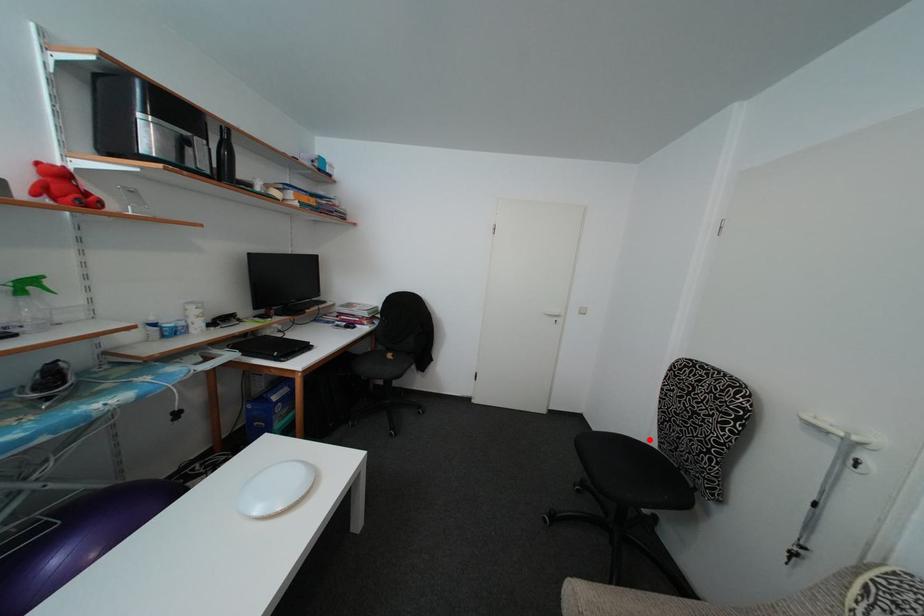
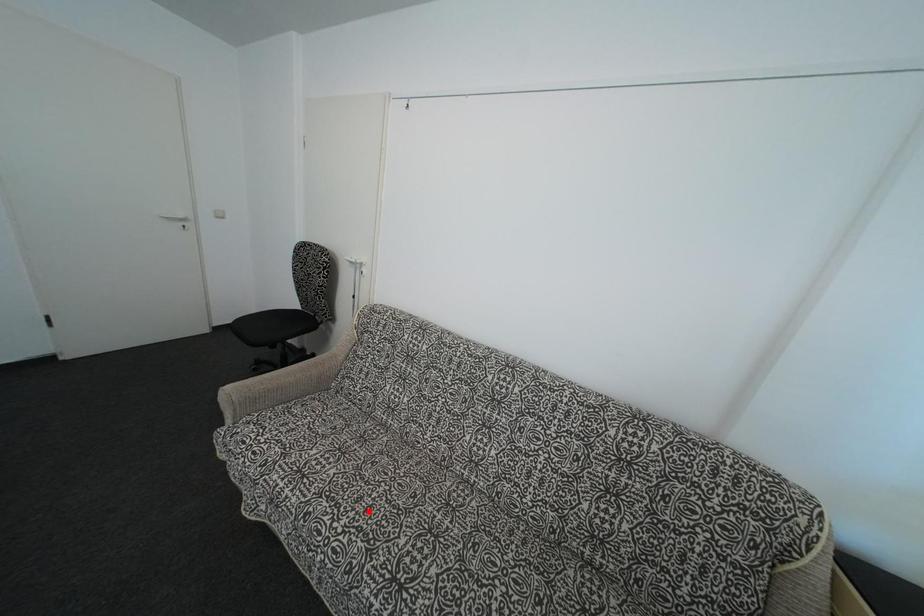
I am providing you with two images of the same scene from different viewpoints. A red point is marked on the first image and another point is marked on the second image. Are the points marked in image1 and image2 representing the same 3D position?

No